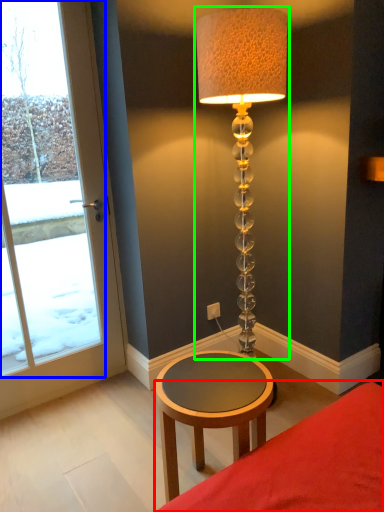
Question: Estimate the real-world distances between objects in this image. Which object is farther from furniture (highlighted by a red box), window (highlighted by a blue box) or lamp (highlighted by a green box)?

Choices:
 (A) window
 (B) lamp

Answer: (A)